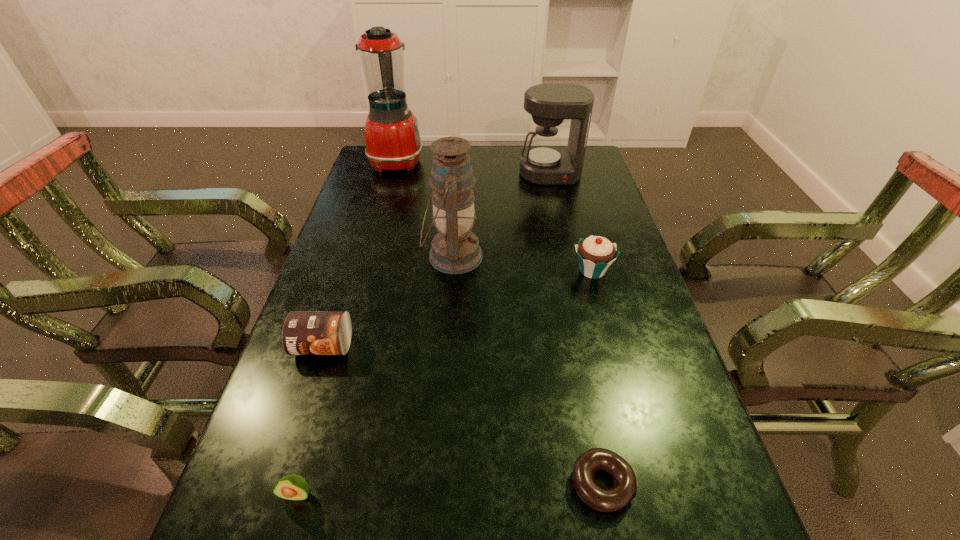
Locate an element on the screen. Image resolution: width=960 pixels, height=540 pixels. cupcake located at the right edge is located at coordinates (595, 253).

This screenshot has width=960, height=540. Find the location of `doughnut that is at the right edge`. doughnut that is at the right edge is located at coordinates (599, 498).

Where is `object that is at the far left corner`? object that is at the far left corner is located at coordinates (392, 137).

I want to click on object that is at the far right corner, so click(x=546, y=163).

Find the location of a particular element. Image resolution: width=960 pixels, height=540 pixels. free location at the far edge of the desktop is located at coordinates (478, 147).

Image resolution: width=960 pixels, height=540 pixels. I want to click on free space at the left edge of the desktop, so click(362, 287).

In the image, there is a desktop. Where is `vacant space at the right edge`? The height and width of the screenshot is (540, 960). vacant space at the right edge is located at coordinates (607, 356).

Image resolution: width=960 pixels, height=540 pixels. Find the location of `vacant space in between the avocado and the doughnut`. vacant space in between the avocado and the doughnut is located at coordinates (449, 489).

I want to click on unoccupied position between the fourth tallest object and the tallest object, so click(494, 216).

Locate an element on the screen. vacant area between the can and the shortest object is located at coordinates (463, 415).